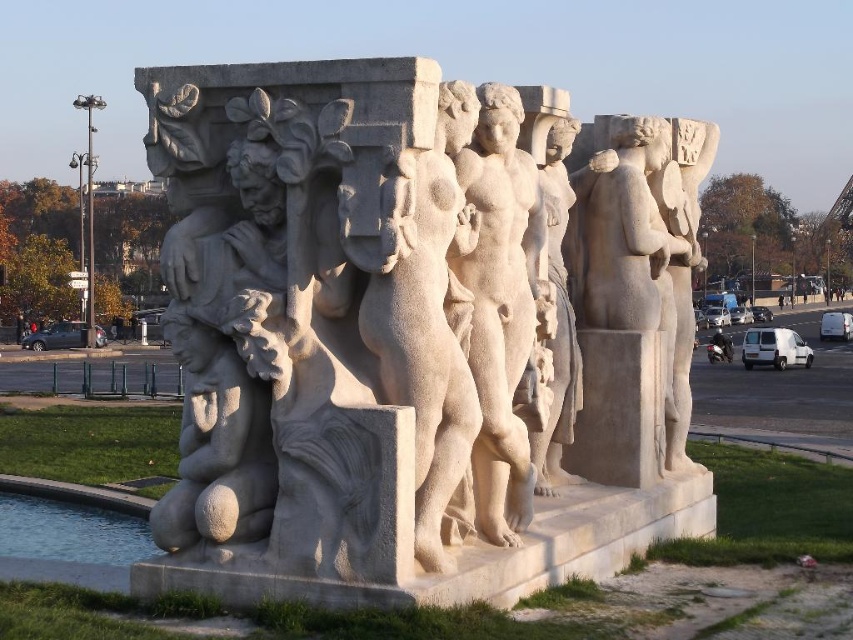
You are an art student analyzing the sculpture. You notice two figures, the smooth stone statue at center and the matte stone figure at lower left. Which one has a greater height?

The smooth stone statue at center is taller than the matte stone figure at lower left.

You are an art student analyzing the sculpture arrangement in the park. You notice the white stone sculpture at center and the matte stone figure at lower left. Which one has a greater height?

The white stone sculpture at center is taller than the matte stone figure at lower left.

You are an art student trying to sketch the sculpture. You notice two central figures in the white stone sculpture at center and the smooth stone statue at center. Which one do you need to focus on more to capture its full width in your drawing?

The white stone sculpture at center has a larger width than the smooth stone statue at center, so you should focus more on capturing the full width of the white stone sculpture at center in your drawing.